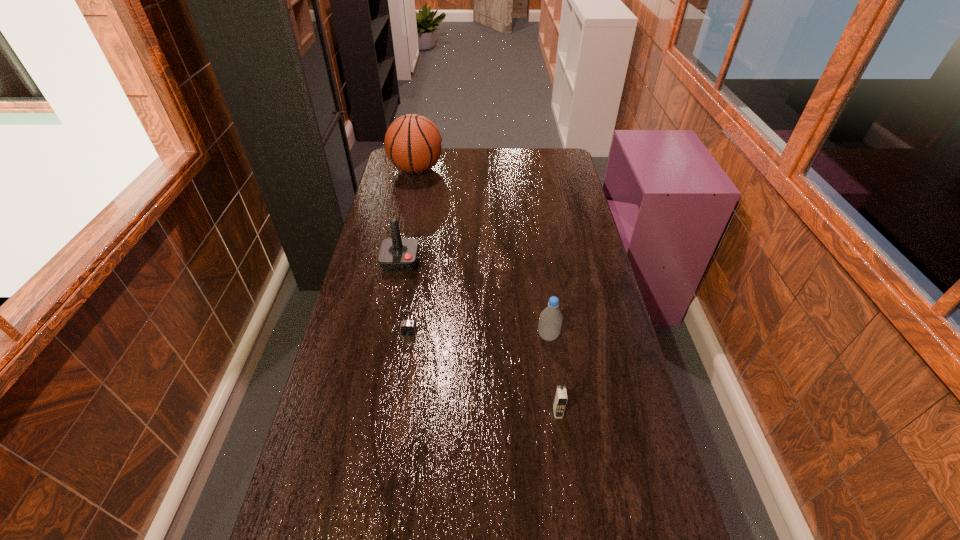
The image size is (960, 540). I want to click on blank area in the image that satisfies the following two spatial constraints: 1. on the side where the inflation valve is located; 2. on the left side of the basketball, so click(383, 336).

You are a GUI agent. You are given a task and a screenshot of the screen. Output one action in this format:
    pyautogui.click(x=<x>, y=<y>)
    Task: Click on the free location that satisfies the following two spatial constraints: 1. on the back side of the fourth nearest object; 2. on the side where the inflation valve is located
    The image size is (960, 540).
    Given the screenshot: What is the action you would take?
    pyautogui.click(x=418, y=170)

This screenshot has height=540, width=960. I want to click on free space that satisfies the following two spatial constraints: 1. on the shackle of the shortest object; 2. on the right side of the bottle, so click(408, 336).